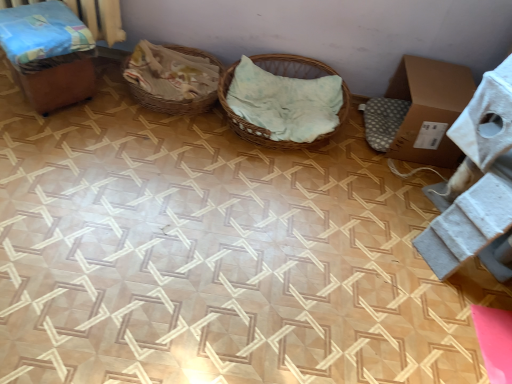
In order to face brown cardboard box at right, should I rotate leftwards or rightwards?

To align with it, rotate right about 20.687°.

This screenshot has height=384, width=512. Identify the location of brown cardboard box at right. (429, 109).

Find the location of `woven brown basket at center, positioned as the second basket in right-to-left order`. woven brown basket at center, positioned as the second basket in right-to-left order is located at coordinates (172, 78).

In order to click on wooden box at left in this screenshot , I will do `click(51, 58)`.

From a real-world perspective, is wooden box at left above or below brown cardboard box at right?

wooden box at left is above brown cardboard box at right.

Which of these two, wooden box at left or brown cardboard box at right, stands taller?

wooden box at left.

From the image's perspective, would you say wooden box at left is shown under brown cardboard box at right?

No, from the image's perspective, wooden box at left is not beneath brown cardboard box at right.

Which point is more forward, (158, 57) or (269, 146)?

Point (269, 146)

Would you say woven brown basket at center, positioned as the second basket in right-to-left order, is to the left or to the right of woven wood basket at center, positioned as the 1th basket in right-to-left order, in the picture?

Based on their positions, woven brown basket at center, positioned as the second basket in right-to-left order, is located to the left of woven wood basket at center, positioned as the 1th basket in right-to-left order.

From the image's perspective, which object appears higher, woven brown basket at center, which ranks as the first basket in left-to-right order, or woven wood basket at center, the second basket viewed from the left?

woven brown basket at center, which ranks as the first basket in left-to-right order, is shown above in the image.

Does woven brown basket at center, which ranks as the first basket in left-to-right order, have a smaller size compared to woven wood basket at center, positioned as the 1th basket in right-to-left order?

Yes.

Is woven wood basket at center, the second basket viewed from the left, at the left side of brown cardboard box at right?

Indeed, woven wood basket at center, the second basket viewed from the left, is positioned on the left side of brown cardboard box at right.

Is woven wood basket at center, the second basket viewed from the left, not close to brown cardboard box at right?

Actually, woven wood basket at center, the second basket viewed from the left, and brown cardboard box at right are a little close together.

Can you confirm if woven wood basket at center, the second basket viewed from the left, is wider than brown cardboard box at right?

Correct, the width of woven wood basket at center, the second basket viewed from the left, exceeds that of brown cardboard box at right.

Is brown cardboard box at right positioned with its back to wooden box at left?

No.

Are brown cardboard box at right and wooden box at left beside each other?

No, brown cardboard box at right is not next to wooden box at left.

Considering the positions of objects brown cardboard box at right and wooden box at left in the image provided, who is in front, brown cardboard box at right or wooden box at left?

wooden box at left is more forward.

Is woven wood basket at center, the second basket viewed from the left, not inside woven brown basket at center, which ranks as the first basket in left-to-right order?

Yes, woven wood basket at center, the second basket viewed from the left, is located beyond the bounds of woven brown basket at center, which ranks as the first basket in left-to-right order.

Which point is more distant from viewer, (322, 62) or (180, 112)?

Positioned behind is point (322, 62).

What's the angular difference between woven wood basket at center, the second basket viewed from the left, and woven brown basket at center, which ranks as the first basket in left-to-right order,'s facing directions?

The facing directions of woven wood basket at center, the second basket viewed from the left, and woven brown basket at center, which ranks as the first basket in left-to-right order, are 0.000138 degrees apart.

Does woven wood basket at center, the second basket viewed from the left, lie behind woven brown basket at center, which ranks as the first basket in left-to-right order?

No, the depth of woven wood basket at center, the second basket viewed from the left, is less than that of woven brown basket at center, which ranks as the first basket in left-to-right order.

Is wooden box at left beside woven brown basket at center, which ranks as the first basket in left-to-right order?

No, wooden box at left is not making contact with woven brown basket at center, which ranks as the first basket in left-to-right order.

Is wooden box at left taller than woven brown basket at center, which ranks as the first basket in left-to-right order?

Yes, wooden box at left is taller than woven brown basket at center, which ranks as the first basket in left-to-right order.

Is wooden box at left looking in the opposite direction of woven brown basket at center, which ranks as the first basket in left-to-right order?

No, wooden box at left is not facing the opposite direction of woven brown basket at center, which ranks as the first basket in left-to-right order.

From a real-world perspective, between wooden box at left and woven brown basket at center, which ranks as the first basket in left-to-right order, who is vertically higher?

In real-world perspective, wooden box at left is above.

Which object is more forward, brown cardboard box at right or woven wood basket at center, positioned as the 1th basket in right-to-left order?

woven wood basket at center, positioned as the 1th basket in right-to-left order.

Between brown cardboard box at right and woven wood basket at center, positioned as the 1th basket in right-to-left order, which one has larger size?

brown cardboard box at right is bigger.

Considering the relative sizes of brown cardboard box at right and woven wood basket at center, positioned as the 1th basket in right-to-left order, in the image provided, is brown cardboard box at right thinner than woven wood basket at center, positioned as the 1th basket in right-to-left order,?

Yes, brown cardboard box at right is thinner than woven wood basket at center, positioned as the 1th basket in right-to-left order.

I want to click on cardboard box on the right of wooden box at left, so click(429, 109).

I want to click on basket below the woven brown basket at center, positioned as the second basket in right-to-left order (from the image's perspective), so click(x=253, y=125).

Which object lies further to the anchor point brown cardboard box at right, wooden box at left or woven brown basket at center, positioned as the second basket in right-to-left order?

wooden box at left is further to brown cardboard box at right.

Based on their spatial positions, is wooden box at left or woven wood basket at center, the second basket viewed from the left, closer to woven brown basket at center, which ranks as the first basket in left-to-right order?

woven wood basket at center, the second basket viewed from the left.

From the image, which object appears to be nearer to wooden box at left, woven brown basket at center, positioned as the second basket in right-to-left order, or woven wood basket at center, positioned as the 1th basket in right-to-left order?

Among the two, woven brown basket at center, positioned as the second basket in right-to-left order, is located nearer to wooden box at left.

From the image, which object appears to be farther from woven wood basket at center, positioned as the 1th basket in right-to-left order, wooden box at left or woven brown basket at center, positioned as the second basket in right-to-left order?

The object further to woven wood basket at center, positioned as the 1th basket in right-to-left order, is wooden box at left.

Which object lies nearer to the anchor point wooden box at left, brown cardboard box at right or woven brown basket at center, positioned as the second basket in right-to-left order?

woven brown basket at center, positioned as the second basket in right-to-left order, is positioned closer to the anchor wooden box at left.

Estimate the real-world distances between objects in this image. Which object is closer to wooden box at left, woven wood basket at center, the second basket viewed from the left, or brown cardboard box at right?

woven wood basket at center, the second basket viewed from the left.

When comparing their distances from woven wood basket at center, the second basket viewed from the left, does brown cardboard box at right or woven brown basket at center, which ranks as the first basket in left-to-right order, seem further?

Among the two, brown cardboard box at right is located further to woven wood basket at center, the second basket viewed from the left.

Based on their spatial positions, is woven brown basket at center, which ranks as the first basket in left-to-right order, or brown cardboard box at right closer to wooden box at left?

woven brown basket at center, which ranks as the first basket in left-to-right order, is closer to wooden box at left.

I want to click on basket between woven brown basket at center, which ranks as the first basket in left-to-right order, and brown cardboard box at right from left to right, so pos(253,125).

Image resolution: width=512 pixels, height=384 pixels. In order to click on basket between wooden box at left and woven wood basket at center, positioned as the 1th basket in right-to-left order in this screenshot , I will do `click(172, 78)`.